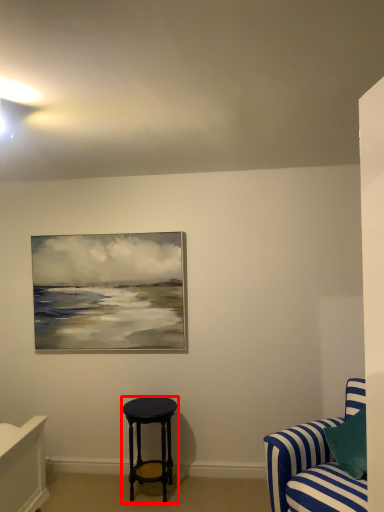
Question: From the image's perspective, what is the correct spatial relationship of stool (annotated by the red box) in relation to studio couch?

Choices:
 (A) above
 (B) below

Answer: (B)